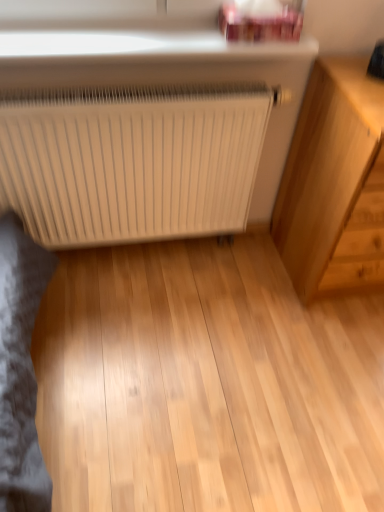
Image resolution: width=384 pixels, height=512 pixels. Find the location of `free space in front of white matte radiator at center`. free space in front of white matte radiator at center is located at coordinates (152, 352).